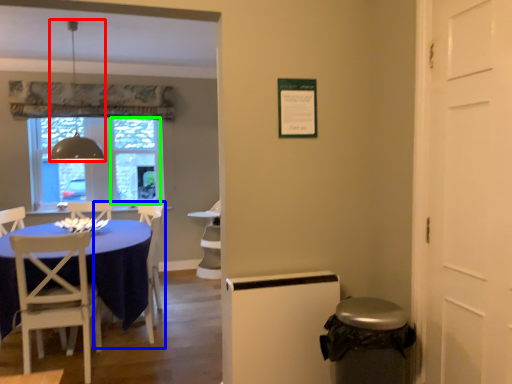
Question: Which is farther away from lamp (highlighted by a red box)? armchair (highlighted by a blue box) or glass door (highlighted by a green box)?

Choices:
 (A) armchair
 (B) glass door

Answer: (B)